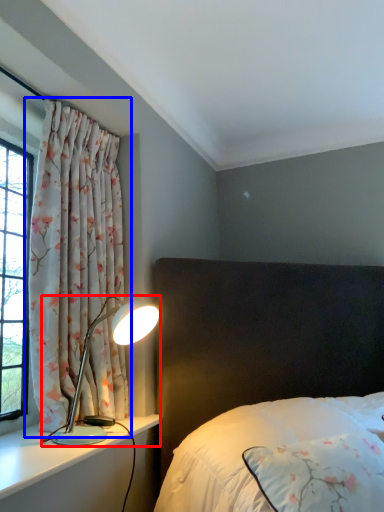
Question: Which object appears closest to the camera in this image, lamp (highlighted by a red box) or curtain (highlighted by a blue box)?

Choices:
 (A) lamp
 (B) curtain

Answer: (A)